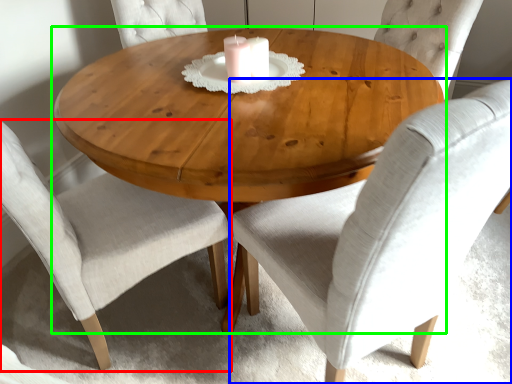
Question: Based on their relative distances, which object is nearer to chair (highlighted by a red box)? Choose from chair (highlighted by a blue box) and coffee table (highlighted by a green box).

Choices:
 (A) chair
 (B) coffee table

Answer: (B)